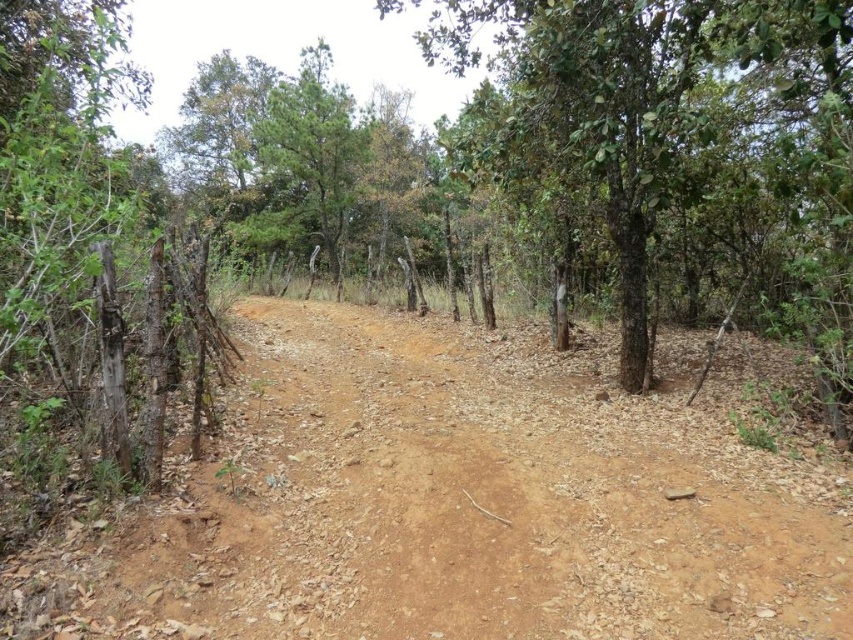
You are a hiker standing at the start of the path. You want to walk to the tree. Which direction should you move relative to the brown dirt track at center and the green rough bark tree at center?

The brown dirt track at center is to the left of the green rough bark tree at center, so you should move to the right relative to the brown dirt track at center to reach the green rough bark tree at center.

You are standing on the rural dirt path and want to walk towards the point that is closer to you. Which point should you walk towards, point (567, 406) or point (840, 189)?

You should walk towards point (567, 406) because it is closer to you than point (840, 189).